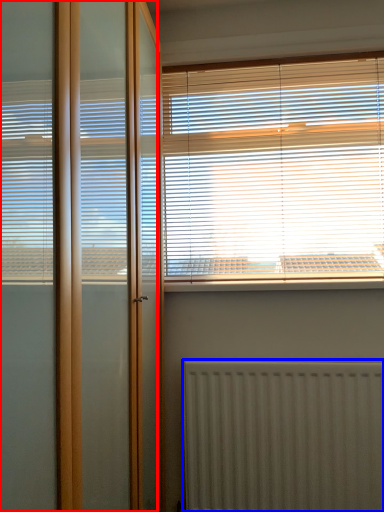
Question: Among these objects, which one is farthest to the camera, screen door (highlighted by a red box) or radiator (highlighted by a blue box)?

Choices:
 (A) screen door
 (B) radiator

Answer: (B)